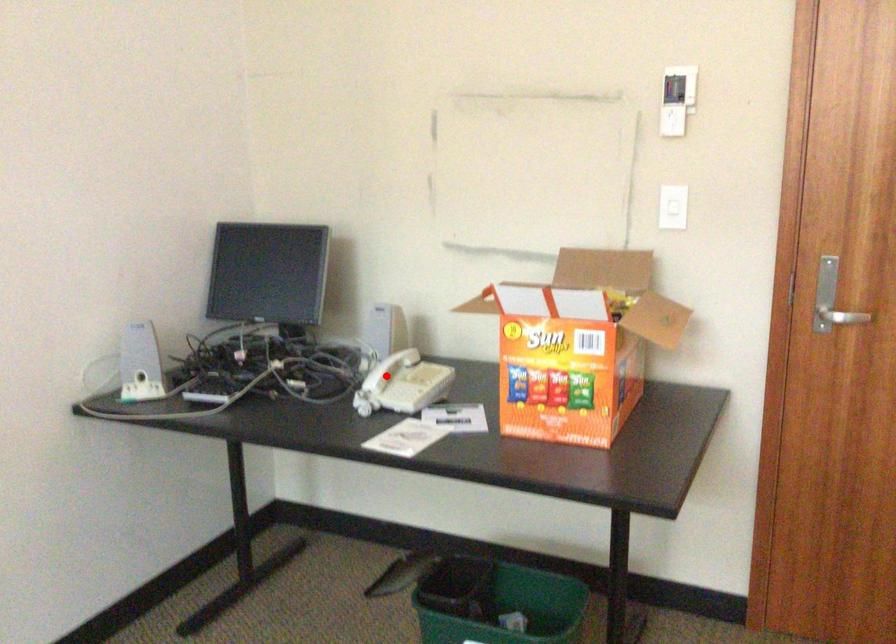
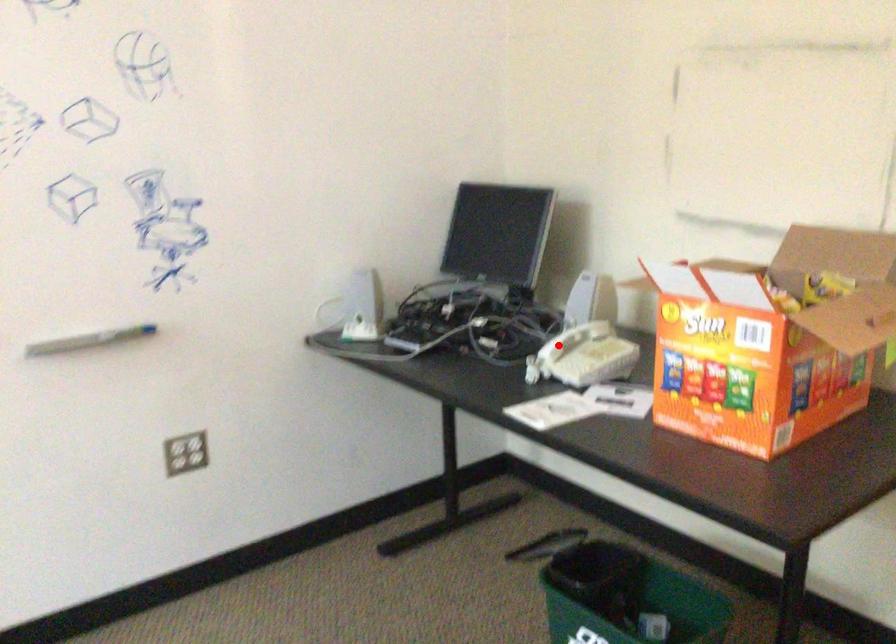
I am providing you with two images of the same scene from different viewpoints. A red point is marked on the first image and another point is marked on the second image. Is the red point in image1 aligned with the point shown in image2?

Yes